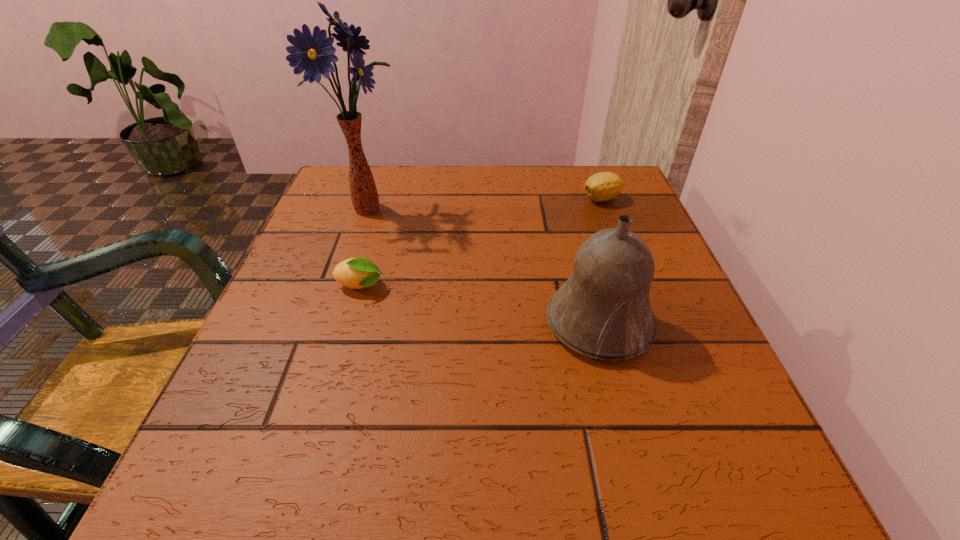
Identify the location of vacant space at the right edge. (703, 339).

Identify the location of free location at the near left corner. (x=246, y=475).

Identify the location of vacant space at the far right corner of the desktop. The height and width of the screenshot is (540, 960). (636, 191).

At what (x,y) coordinates should I click in order to perform the action: click on free space at the near right corner of the desktop. Please return your answer as a coordinate pair (x, y). Looking at the image, I should click on (727, 446).

This screenshot has width=960, height=540. Find the location of `free space that is in between the nearer lemon and the bell`. free space that is in between the nearer lemon and the bell is located at coordinates (480, 305).

Where is `free space between the right lemon and the flower arrangement`? This screenshot has height=540, width=960. free space between the right lemon and the flower arrangement is located at coordinates (486, 203).

Locate an element on the screen. The width and height of the screenshot is (960, 540). free space that is in between the bell and the flower arrangement is located at coordinates (484, 265).

Where is `vacant area that lies between the nearer lemon and the flower arrangement`? vacant area that lies between the nearer lemon and the flower arrangement is located at coordinates (365, 247).

The image size is (960, 540). What are the coordinates of `vacant space that is in between the left lemon and the farther lemon` in the screenshot? It's located at (481, 242).

The width and height of the screenshot is (960, 540). I want to click on free space between the flower arrangement and the farther lemon, so click(x=486, y=203).